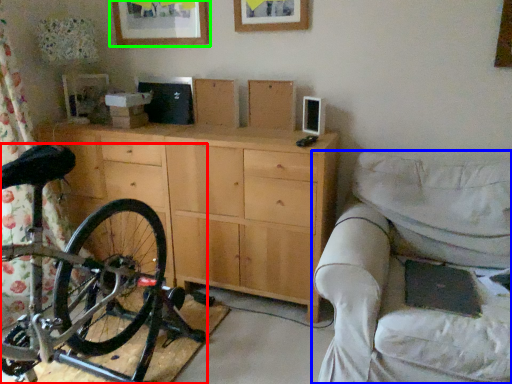
Question: Considering the real-world distances, which object is closest to bicycle (highlighted by a red box)? studio couch (highlighted by a blue box) or picture frame (highlighted by a green box).

Choices:
 (A) studio couch
 (B) picture frame

Answer: (A)